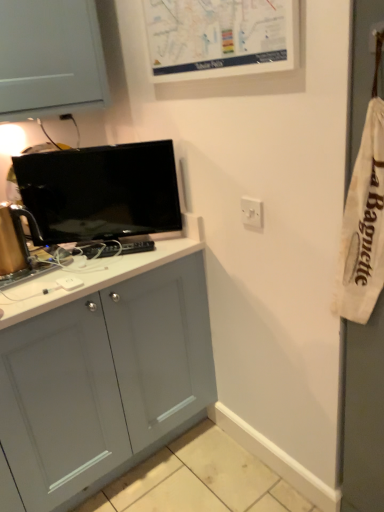
Question: Is matte black tv at upper left wider than white plastic switch at upper right?

Choices:
 (A) no
 (B) yes

Answer: (B)

Question: Is matte black tv at upper left shorter than white plastic switch at upper right?

Choices:
 (A) yes
 (B) no

Answer: (B)

Question: Is matte black tv at upper left aimed at white plastic switch at upper right?

Choices:
 (A) no
 (B) yes

Answer: (A)

Question: Is matte black tv at upper left next to white plastic switch at upper right and touching it?

Choices:
 (A) no
 (B) yes

Answer: (A)

Question: Is matte black tv at upper left positioned far away from white plastic switch at upper right?

Choices:
 (A) yes
 (B) no

Answer: (B)

Question: From a real-world perspective, is matte black tv at upper left positioned under white plastic switch at upper right based on gravity?

Choices:
 (A) yes
 (B) no

Answer: (B)

Question: Are white plastic switch at upper right and matte black tv at upper left far apart?

Choices:
 (A) no
 (B) yes

Answer: (A)

Question: Can we say white plastic switch at upper right lies outside matte black tv at upper left?

Choices:
 (A) yes
 (B) no

Answer: (A)

Question: From the image's perspective, would you say white plastic switch at upper right is positioned over matte black tv at upper left?

Choices:
 (A) yes
 (B) no

Answer: (B)

Question: Is white plastic switch at upper right bigger than matte black tv at upper left?

Choices:
 (A) no
 (B) yes

Answer: (A)

Question: Is white plastic switch at upper right at the left side of matte black tv at upper left?

Choices:
 (A) no
 (B) yes

Answer: (A)

Question: Does white plastic switch at upper right have a greater width compared to matte black tv at upper left?

Choices:
 (A) yes
 (B) no

Answer: (B)

Question: Is white plastic switch at upper right at the back of white matte map at upper center?

Choices:
 (A) no
 (B) yes

Answer: (A)